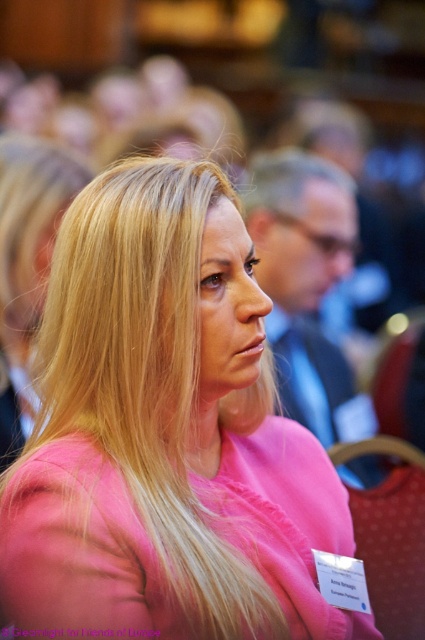
Is pink matte shirt at center below pink fabric shirt at center?

Yes.

Where is `pink matte shirt at center`? The width and height of the screenshot is (425, 640). pink matte shirt at center is located at coordinates (164, 435).